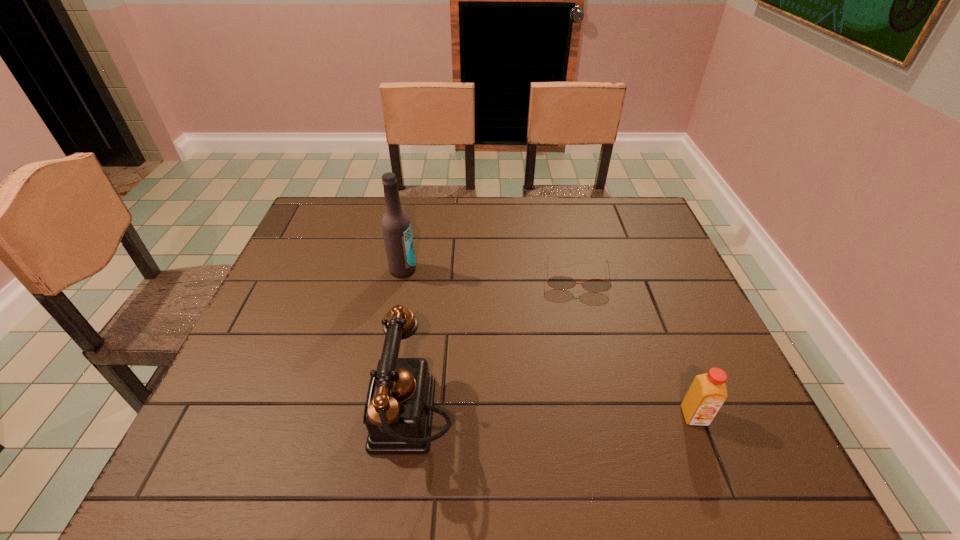
At what (x,y) coordinates should I click in order to perform the action: click on free spot located 0.210m on the label of the tallest object. Please return your answer as a coordinate pair (x, y). The width and height of the screenshot is (960, 540). Looking at the image, I should click on (459, 318).

Locate an element on the screen. The height and width of the screenshot is (540, 960). free location located 0.270m on the label of the tallest object is located at coordinates (474, 332).

Where is `vacant area located on the face of the shortest object`? The image size is (960, 540). vacant area located on the face of the shortest object is located at coordinates (582, 381).

Find the location of `free region located on the face of the shortest object`. free region located on the face of the shortest object is located at coordinates (580, 356).

The image size is (960, 540). I want to click on free space located on the face of the shortest object, so click(x=578, y=313).

The image size is (960, 540). What are the coordinates of `telephone that is at the near edge` in the screenshot? It's located at (398, 413).

I want to click on orange juice positioned at the near edge, so click(x=706, y=395).

I want to click on object that is at the right edge, so click(x=706, y=395).

At what (x,y) coordinates should I click in order to perform the action: click on object at the near right corner. Please return your answer as a coordinate pair (x, y). The width and height of the screenshot is (960, 540). Looking at the image, I should click on (706, 395).

The image size is (960, 540). In the image, there is a desktop. In order to click on vacant space at the far edge in this screenshot , I will do `click(536, 234)`.